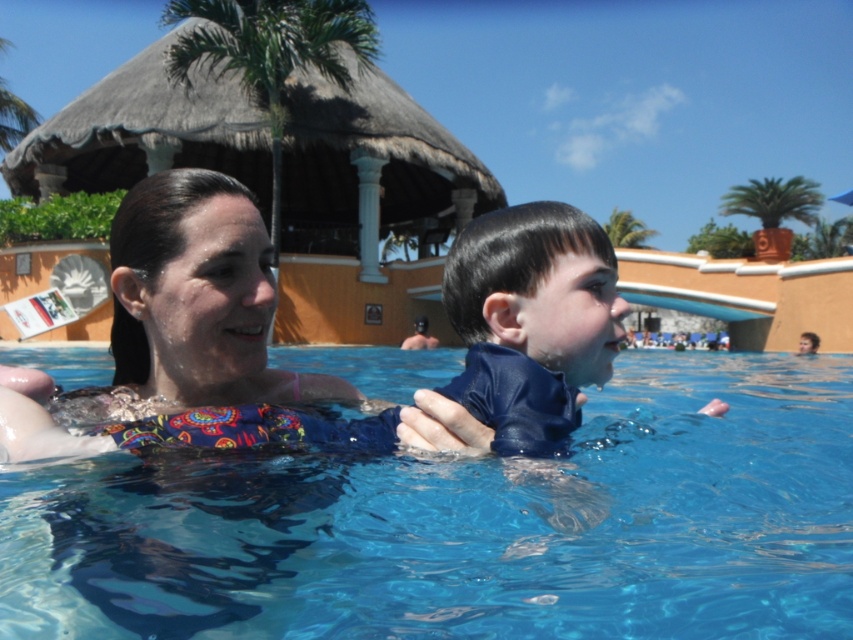
You are a GUI agent. You are given a task and a screenshot of the screen. Output one action in this format:
    pyautogui.click(x=<x>, y=<y>)
    Task: Click on the transparent blue water at center
    
    Given the screenshot: What is the action you would take?
    pyautogui.click(x=469, y=525)

Who is shorter, transparent blue water at center or blue matte wetsuit at center?

transparent blue water at center

Is point (283, 609) closer to viewer compared to point (465, 416)?

That is True.

In order to click on transparent blue water at center in this screenshot , I will do pos(469,525).